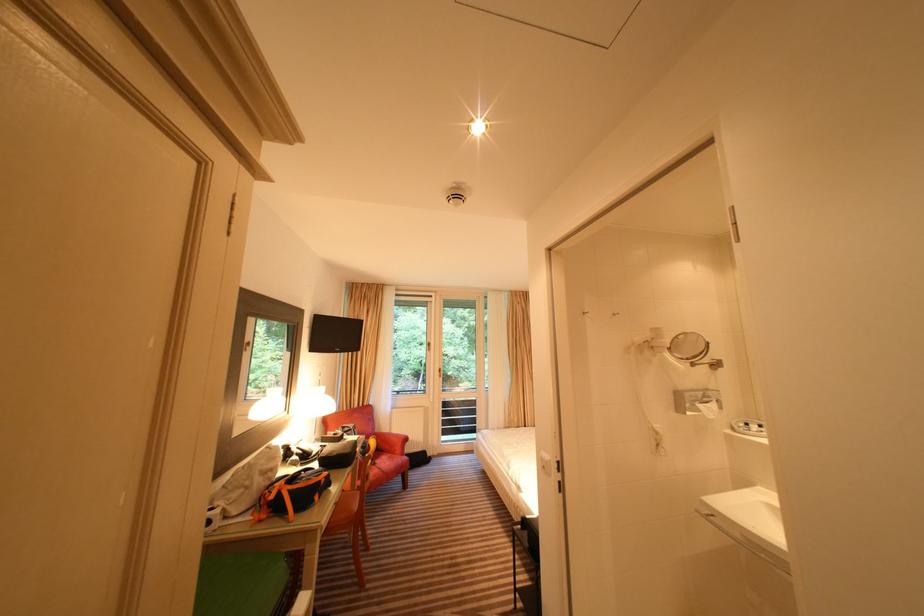
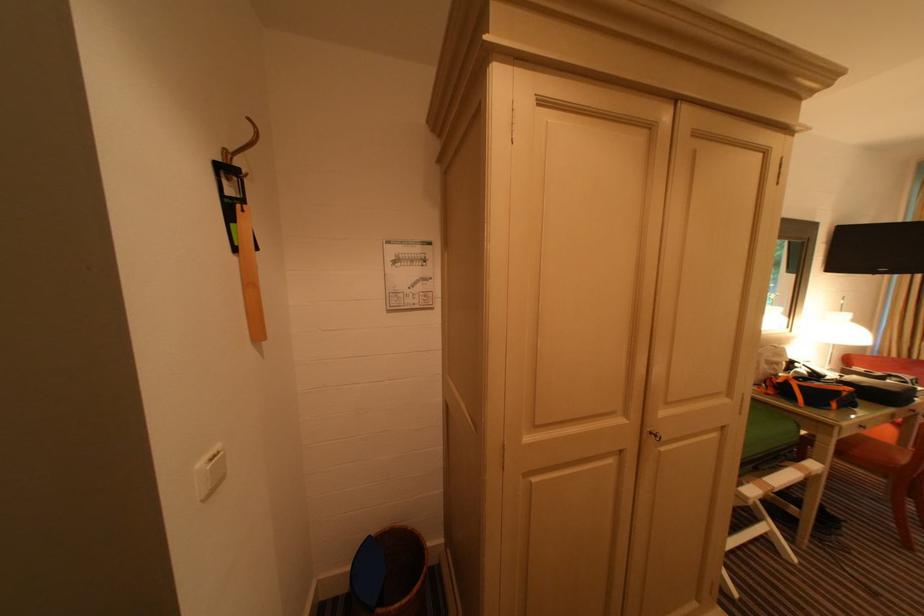
Question: How did the camera likely rotate?

Choices:
 (A) Left
 (B) Right
 (C) Up
 (D) Down

Answer: (A)